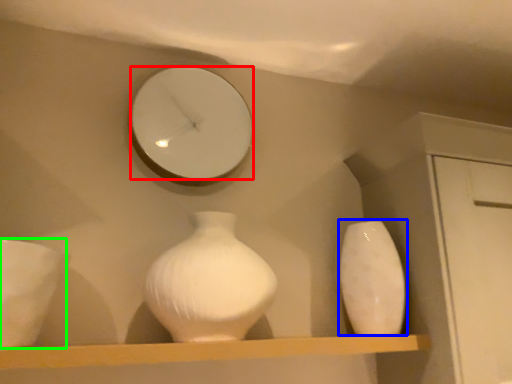
Question: Considering the real-world distances, which object is closest to mirror (highlighted by a red box)? vase (highlighted by a blue box) or porcelain (highlighted by a green box).

Choices:
 (A) vase
 (B) porcelain

Answer: (B)